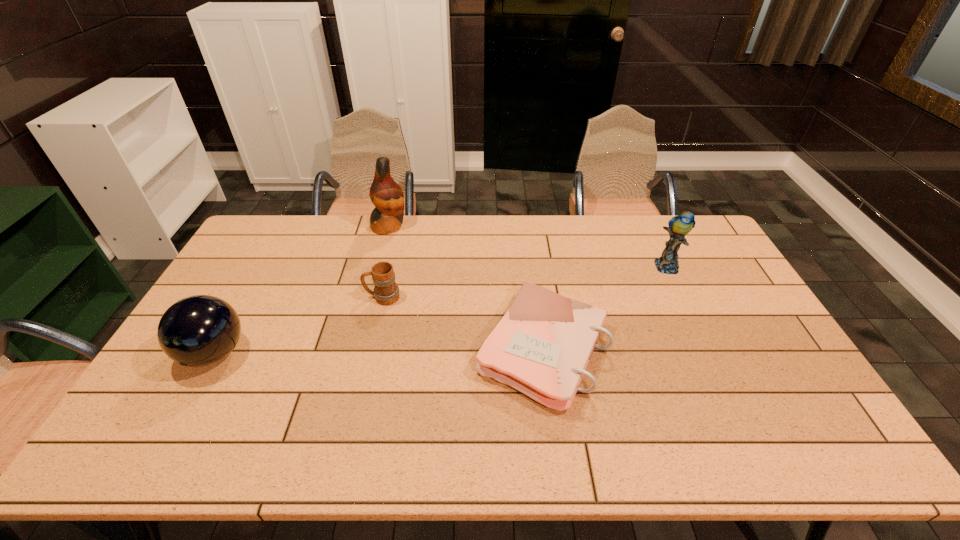
You are a GUI agent. You are given a task and a screenshot of the screen. Output one action in this format:
    pyautogui.click(x=<x>, y=<y>)
    Task: Click on the free space between the taller parrot and the shortest object
    Image resolution: width=960 pixels, height=540 pixels.
    Given the screenshot: What is the action you would take?
    pyautogui.click(x=466, y=287)

What are the coordinates of `unoccupied position between the shortest object and the taller parrot` in the screenshot? It's located at (466, 287).

Where is `the fourth closest object to the tallest object`? This screenshot has width=960, height=540. the fourth closest object to the tallest object is located at coordinates (679, 226).

Identify which object is located as the nearest to the farther parrot. Please provide its 2D coordinates. Your answer should be formatted as a tuple, i.e. [(x, y)], where the tuple contains the x and y coordinates of a point satisfying the conditions above.

[(386, 291)]

The width and height of the screenshot is (960, 540). Find the location of `vacant space that satisfies the following two spatial constraints: 1. on the face of the farthest object; 2. on the side of the bowling ball with the finger holes`. vacant space that satisfies the following two spatial constraints: 1. on the face of the farthest object; 2. on the side of the bowling ball with the finger holes is located at coordinates pyautogui.click(x=356, y=353).

Identify the location of free space that satisfies the following two spatial constraints: 1. on the side of the mug with the handle; 2. on the side of the third tallest object with the finger holes. This screenshot has height=540, width=960. (370, 353).

I want to click on vacant region that satisfies the following two spatial constraints: 1. on the side of the mug with the handle; 2. on the side of the leftmost object with the finger holes, so click(x=370, y=353).

Image resolution: width=960 pixels, height=540 pixels. Identify the location of free location that satisfies the following two spatial constraints: 1. on the face of the taller parrot; 2. on the back side of the fourth object from left to right. (357, 349).

Locate an element on the screen. free space that satisfies the following two spatial constraints: 1. on the side of the mug with the handle; 2. on the side of the bowling ball with the finger holes is located at coordinates (370, 353).